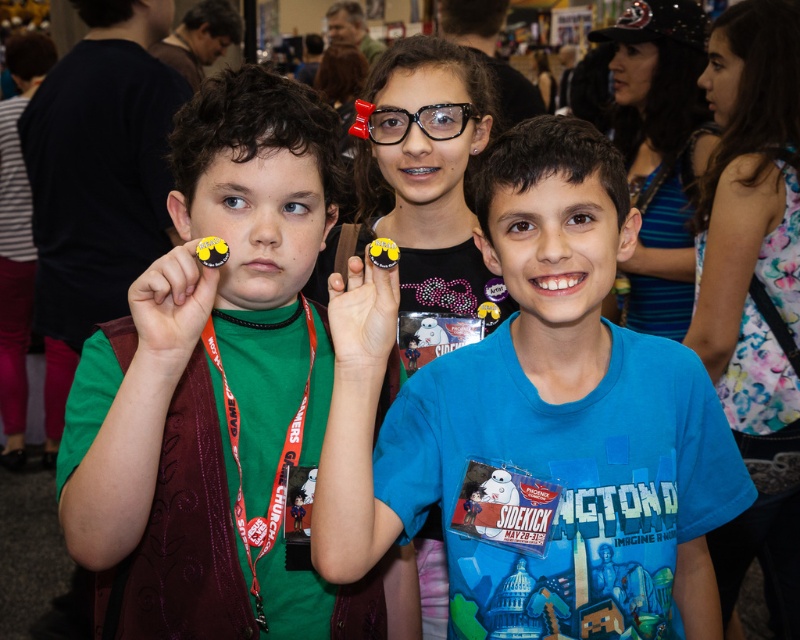
Which of these two, green fabric vest at left or blue matte shirt at center, stands shorter?

blue matte shirt at center is shorter.

The height and width of the screenshot is (640, 800). What do you see at coordinates (224, 362) in the screenshot? I see `green fabric vest at left` at bounding box center [224, 362].

I want to click on green fabric vest at left, so click(x=224, y=362).

Is point (674, 362) closer to camera compared to point (282, 506)?

No, (674, 362) is behind (282, 506).

Does blue matte shirt at center come behind red fabric lanyard at center?

No, it is in front of red fabric lanyard at center.

Who is more forward, (574, 280) or (210, 339)?

Point (574, 280) is in front.

Identify the location of blue matte shirt at center. (524, 378).

Between red fabric lanyard at center and clear plastic glasses at center, which one is positioned lower?

red fabric lanyard at center

Can you confirm if red fabric lanyard at center is thinner than clear plastic glasses at center?

Yes, red fabric lanyard at center is thinner than clear plastic glasses at center.

Measure the distance between red fabric lanyard at center and camera.

The distance of red fabric lanyard at center from camera is 1.10 meters.

Locate an element on the screen. The width and height of the screenshot is (800, 640). red fabric lanyard at center is located at coordinates (276, 467).